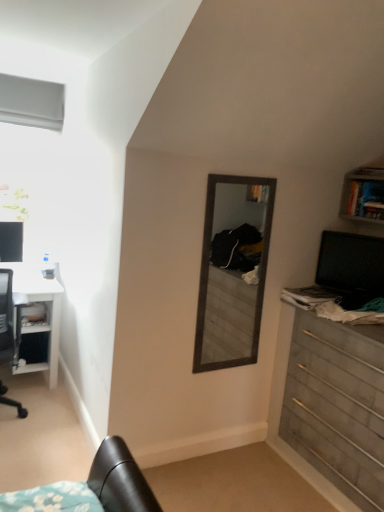
Question: Is brushed metal shelf at lower left bigger than white matte window at upper left?

Choices:
 (A) no
 (B) yes

Answer: (A)

Question: From a real-world perspective, is brushed metal shelf at lower left positioned under white matte window at upper left based on gravity?

Choices:
 (A) no
 (B) yes

Answer: (B)

Question: Does brushed metal shelf at lower left contain white matte window at upper left?

Choices:
 (A) no
 (B) yes

Answer: (A)

Question: Is brushed metal shelf at lower left to the left of white matte window at upper left from the viewer's perspective?

Choices:
 (A) no
 (B) yes

Answer: (A)

Question: Is brushed metal shelf at lower left wider than white matte window at upper left?

Choices:
 (A) no
 (B) yes

Answer: (A)

Question: Is brushed metal shelf at lower left aimed at white matte window at upper left?

Choices:
 (A) no
 (B) yes

Answer: (A)

Question: Is wooden chest of drawers at right facing away from matte black monitor at left, the 1th computer monitor positioned from the back?

Choices:
 (A) yes
 (B) no

Answer: (B)

Question: From a real-world perspective, does wooden chest of drawers at right stand above matte black monitor at left, the second computer monitor when ordered from right to left?

Choices:
 (A) no
 (B) yes

Answer: (A)

Question: From a real-world perspective, is wooden chest of drawers at right beneath matte black monitor at left, the second computer monitor viewed from the front?

Choices:
 (A) yes
 (B) no

Answer: (A)

Question: Considering the relative positions of wooden chest of drawers at right and matte black monitor at left, the second computer monitor when ordered from right to left, in the image provided, is wooden chest of drawers at right to the left of matte black monitor at left, the second computer monitor when ordered from right to left, from the viewer's perspective?

Choices:
 (A) yes
 (B) no

Answer: (B)

Question: Are wooden chest of drawers at right and matte black monitor at left, the 1th computer monitor positioned from the back, located far from each other?

Choices:
 (A) yes
 (B) no

Answer: (A)

Question: Is wooden chest of drawers at right bigger than matte black monitor at left, the second computer monitor viewed from the front?

Choices:
 (A) yes
 (B) no

Answer: (A)

Question: Is wooden chest of drawers at right next to white glossy desk at left?

Choices:
 (A) yes
 (B) no

Answer: (B)